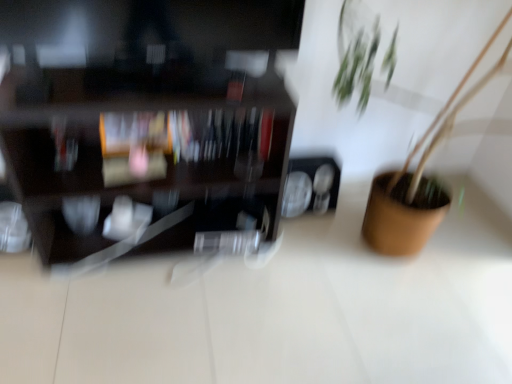
I want to click on brown matte pot at right, so point(420,177).

What is the approximate height of brown matte pot at right?

It is 3.92 feet.

What do you see at coordinates (420, 177) in the screenshot? The height and width of the screenshot is (384, 512). I see `brown matte pot at right` at bounding box center [420, 177].

Identify the location of dark wood shelf at left. The image size is (512, 384). (147, 125).

Describe the element at coordinates (147, 125) in the screenshot. I see `dark wood shelf at left` at that location.

Identify the location of brown matte pot at right. The width and height of the screenshot is (512, 384). (420, 177).

Does brown matte pot at right appear on the left side of dark wood shelf at left?

Incorrect, brown matte pot at right is not on the left side of dark wood shelf at left.

Relative to dark wood shelf at left, is brown matte pot at right in front or behind?

brown matte pot at right is in front of dark wood shelf at left.

Between point (404, 193) and point (216, 9), which one is positioned in front?

Point (216, 9)

From the image's perspective, relative to dark wood shelf at left, is brown matte pot at right above or below?

brown matte pot at right is below dark wood shelf at left.

From a real-world perspective, is brown matte pot at right positioned over dark wood shelf at left based on gravity?

Yes, from a real-world perspective, brown matte pot at right is on top of dark wood shelf at left.

Is brown matte pot at right wider than dark wood shelf at left?

Indeed, brown matte pot at right has a greater width compared to dark wood shelf at left.

Can you confirm if brown matte pot at right is shorter than dark wood shelf at left?

In fact, brown matte pot at right may be taller than dark wood shelf at left.

Considering the sizes of objects brown matte pot at right and dark wood shelf at left in the image provided, who is smaller, brown matte pot at right or dark wood shelf at left?

dark wood shelf at left is smaller.

Is brown matte pot at right inside the boundaries of dark wood shelf at left, or outside?

brown matte pot at right cannot be found inside dark wood shelf at left.

Are brown matte pot at right and dark wood shelf at left far apart?

brown matte pot at right is actually quite close to dark wood shelf at left.

Is brown matte pot at right turned away from dark wood shelf at left?

That's not correct — brown matte pot at right is not looking away from dark wood shelf at left.

Can you tell me how much brown matte pot at right and dark wood shelf at left differ in facing direction?

3.39 degrees separate the facing orientations of brown matte pot at right and dark wood shelf at left.

How much distance is there between brown matte pot at right and dark wood shelf at left?

brown matte pot at right is 35.94 inches away from dark wood shelf at left.

The height and width of the screenshot is (384, 512). I want to click on shelf that is under the brown matte pot at right (from a real-world perspective), so click(147, 125).

Which object is positioned more to the left, dark wood shelf at left or brown matte pot at right?

dark wood shelf at left.

Consider the image. Is the position of dark wood shelf at left less distant than that of brown matte pot at right?

No, the depth of dark wood shelf at left is greater than that of brown matte pot at right.

Between point (172, 15) and point (430, 204), which one is positioned behind?

The point (430, 204) is more distant.

From the image's perspective, which one is positioned higher, dark wood shelf at left or brown matte pot at right?

dark wood shelf at left, from the image's perspective.

From a real-world perspective, is dark wood shelf at left positioned above or below brown matte pot at right?

dark wood shelf at left is below brown matte pot at right.

Which object is thinner, dark wood shelf at left or brown matte pot at right?

With smaller width is dark wood shelf at left.

Does dark wood shelf at left have a greater height compared to brown matte pot at right?

In fact, dark wood shelf at left may be shorter than brown matte pot at right.

Who is bigger, dark wood shelf at left or brown matte pot at right?

With larger size is brown matte pot at right.

Is dark wood shelf at left not within brown matte pot at right?

Yes, dark wood shelf at left is outside of brown matte pot at right.

Is dark wood shelf at left placed right next to brown matte pot at right?

They are not placed beside each other.

Could you tell me if dark wood shelf at left is turned towards brown matte pot at right?

No, dark wood shelf at left is not facing towards brown matte pot at right.

Can you tell me how much dark wood shelf at left and brown matte pot at right differ in facing direction?

3.39 degrees separate the facing orientations of dark wood shelf at left and brown matte pot at right.

Consider the image. How much distance is there between dark wood shelf at left and brown matte pot at right?

A distance of 35.94 inches exists between dark wood shelf at left and brown matte pot at right.

The height and width of the screenshot is (384, 512). I want to click on houseplant located above the dark wood shelf at left (from a real-world perspective), so click(420, 177).

Identify the location of houseplant located above the dark wood shelf at left (from a real-world perspective). (420, 177).

The width and height of the screenshot is (512, 384). Find the location of `shelf on the left of brown matte pot at right`. shelf on the left of brown matte pot at right is located at coordinates coord(147,125).